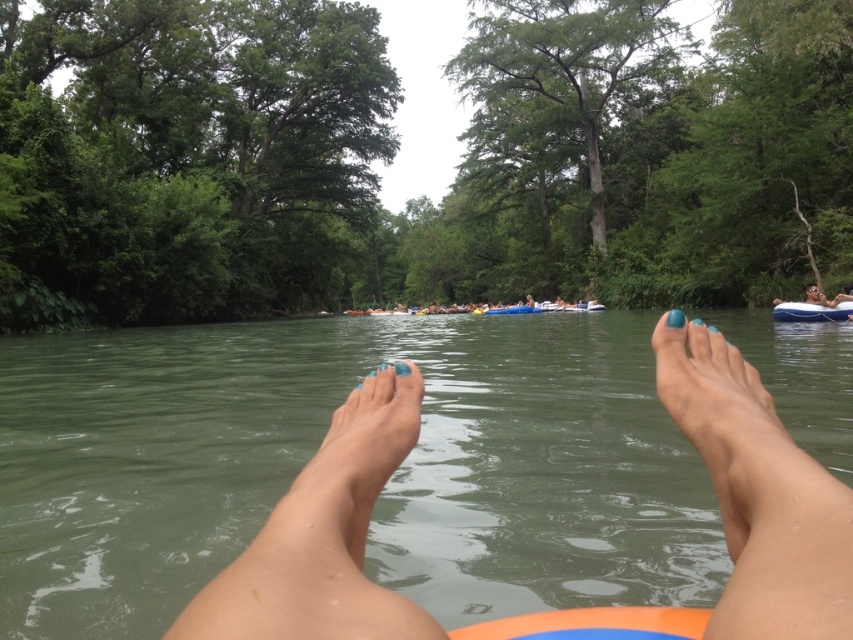
You are a photographer trying to capture a closeup shot of both the teal matte foot at center and the blue matte foot at center in the image. Given that your camera can only focus on objects within a 15 inch range, will you be able to capture both feet in focus?

The teal matte foot at center is 16.12 inches from blue matte foot at center. Since the distance between them exceeds the camera focus range of 15 inches, you won cannot capture both feet in focus.